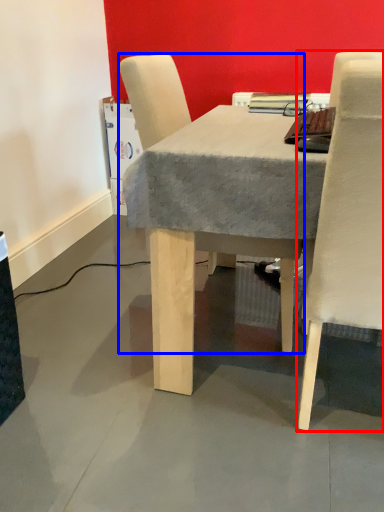
Question: Among these objects, which one is nearest to the camera, chair (highlighted by a red box) or chair (highlighted by a blue box)?

Choices:
 (A) chair
 (B) chair

Answer: (A)